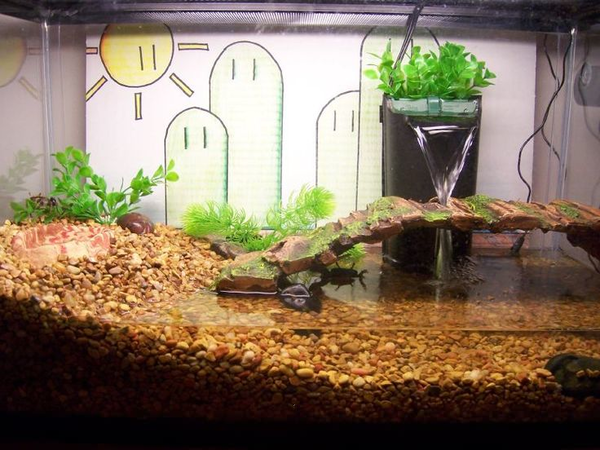
At what (x,y) coordinates should I click in order to perform the action: click on black cables. Please return your answer as a coordinate pair (x, y). This screenshot has height=450, width=600. Looking at the image, I should click on (545, 140), (520, 149).